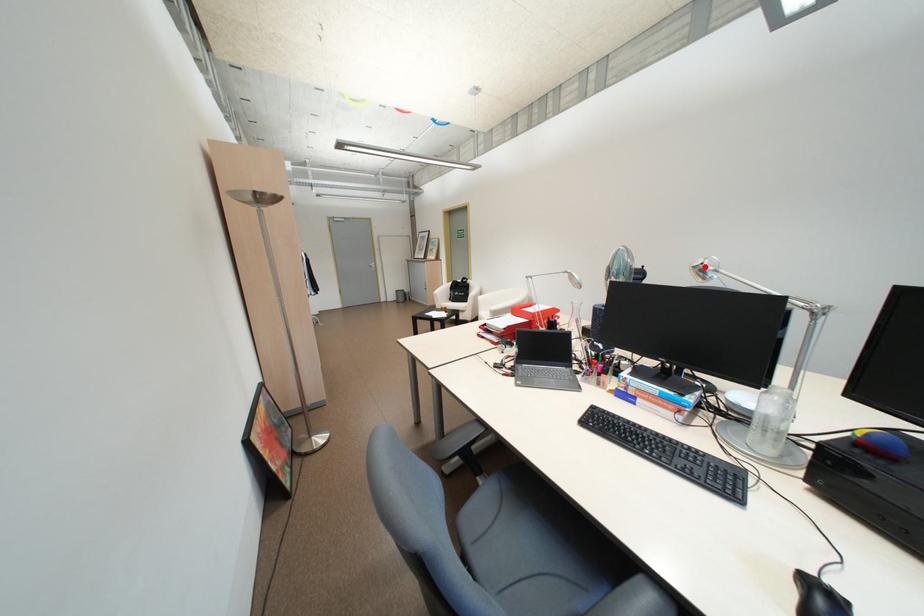
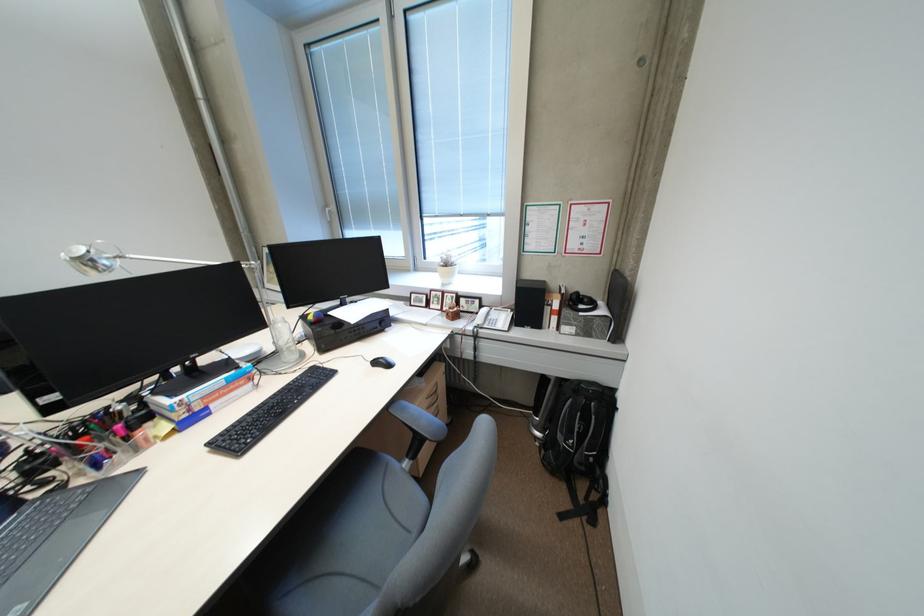
Find the pixel in the second image that matches the highlighted location in the first image.

(90, 257)